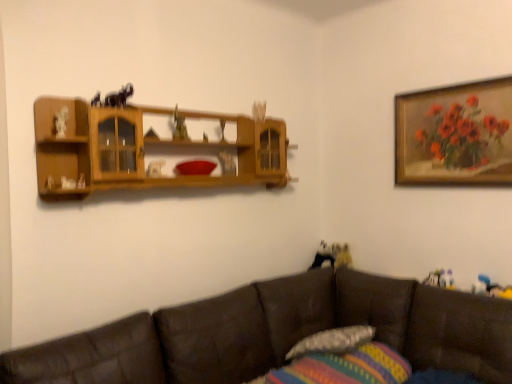
Question: Considering the relative positions of textured fabric pillow at lower center, which is the second pillow from bottom to top, and wooden framed painting of flowers at upper right in the image provided, is textured fabric pillow at lower center, which is the second pillow from bottom to top, to the left or to the right of wooden framed painting of flowers at upper right?

Choices:
 (A) right
 (B) left

Answer: (B)

Question: Do you think textured fabric pillow at lower center, which appears as the 1th pillow when viewed from the top, is within wooden framed painting of flowers at upper right, or outside of it?

Choices:
 (A) outside
 (B) inside

Answer: (A)

Question: Which object is positioned closest to the striped fabric pillow at lower center, which ranks as the 1th pillow in bottom-to-top order?

Choices:
 (A) brown leather couch at lower right
 (B) textured fabric pillow at lower center, which appears as the 1th pillow when viewed from the top
 (C) wooden framed painting of flowers at upper right
 (D) wooden shelf at upper center

Answer: (B)

Question: Based on their relative distances, which object is nearer to the striped fabric pillow at lower center, the 2th pillow viewed from the top?

Choices:
 (A) brown leather couch at lower right
 (B) textured fabric pillow at lower center, which is the second pillow from bottom to top
 (C) wooden shelf at upper center
 (D) wooden framed painting of flowers at upper right

Answer: (B)